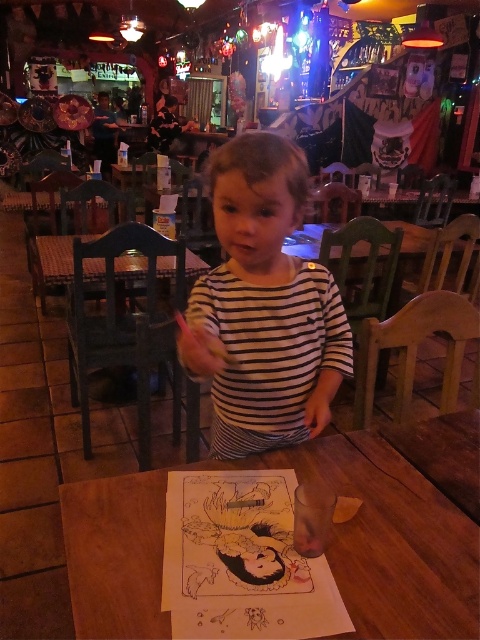
Question: Which point is closer to the camera?

Choices:
 (A) wooden table at center
 (B) white striped shirt at center

Answer: (A)

Question: Which object appears closest to the camera in this image?

Choices:
 (A) wooden table at center
 (B) white striped shirt at center

Answer: (A)

Question: Is wooden table at center bigger than white striped shirt at center?

Choices:
 (A) yes
 (B) no

Answer: (B)

Question: Can you confirm if wooden table at center is smaller than white striped shirt at center?

Choices:
 (A) no
 (B) yes

Answer: (B)

Question: Can you confirm if wooden table at center is positioned to the right of white striped shirt at center?

Choices:
 (A) no
 (B) yes

Answer: (B)

Question: Which point is farther from the camera taking this photo?

Choices:
 (A) tap(90, 628)
 (B) tap(297, 428)

Answer: (B)